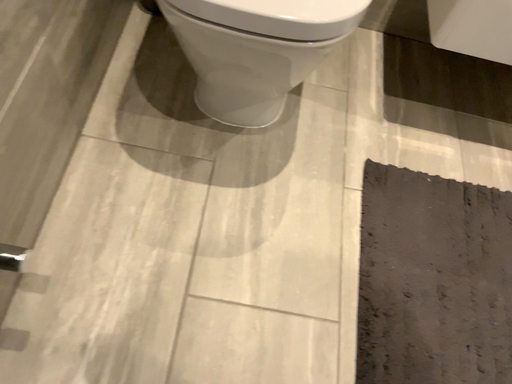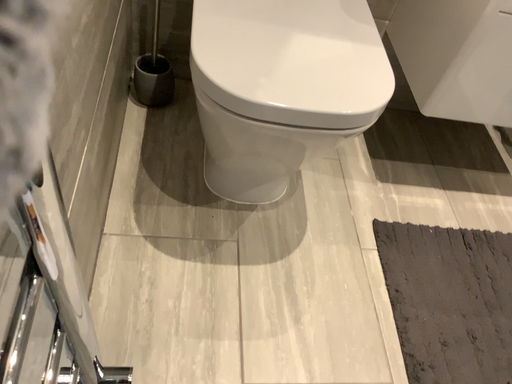
Question: How did the camera likely rotate when shooting the video?

Choices:
 (A) rotated right
 (B) rotated left

Answer: (A)